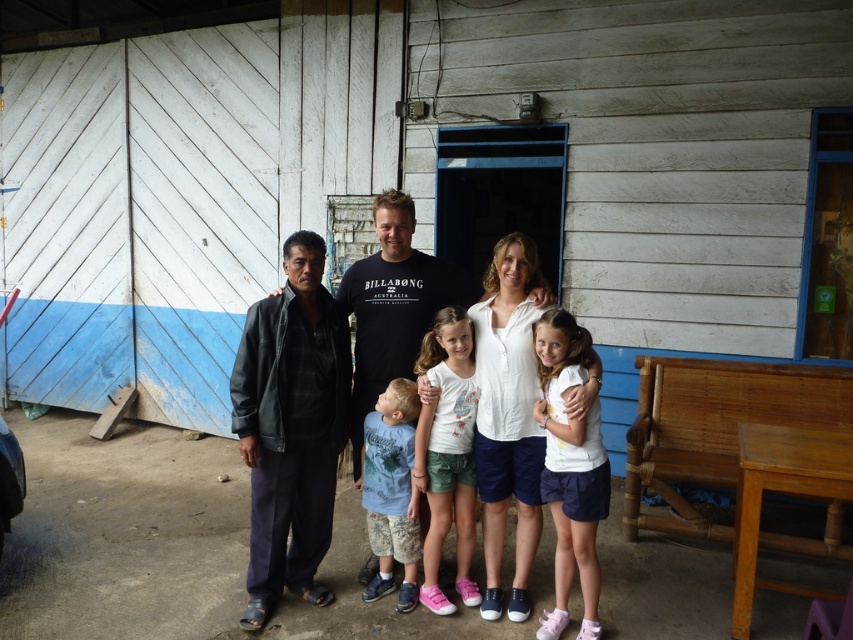
You are a photographer trying to capture a photo of the group. You notice the white cotton shirt at center and the matte black jacket at center. Which one is blocking the other from being fully visible?

The white cotton shirt at center is in front of matte black jacket at center, so it is blocking the matte black jacket at center from being fully visible.

You are standing at the point labeled as point (465,333) and want to walk towards the building. Is the point labeled as point (590,548) between you and the building?

Yes, the point labeled as point (590,548) is between you and the building because it is in front of point (465,333), which is your current position.

You are a photographer who needs to adjust the camera focus to capture both adults clearly. Given the distance between the white matte shirt at center and white cotton shirt at center, can you focus on both simultaneously?

The distance between the white matte shirt at center and white cotton shirt at center is 18.20 inches, so yes, the photographer can focus on both simultaneously as they are within a reasonable focus range.